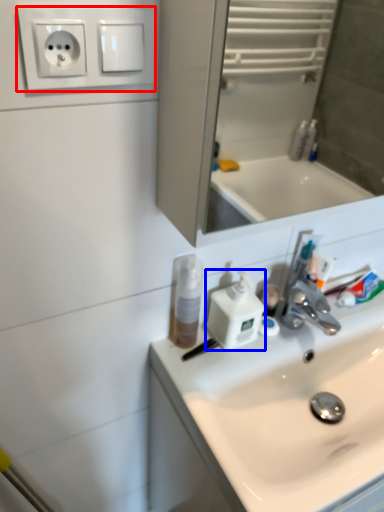
Question: Which object appears closest to the camera in this image, electric outlet (highlighted by a red box) or soap dispenser (highlighted by a blue box)?

Choices:
 (A) electric outlet
 (B) soap dispenser

Answer: (A)